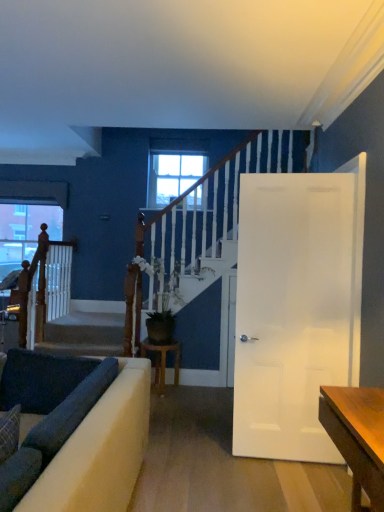
Question: Is clear glass window at center, positioned as the 2th window in left-to-right order, not near white glossy door at right?

Choices:
 (A) yes
 (B) no

Answer: (A)

Question: From the image's perspective, is clear glass window at center, acting as the first window starting from the top, located beneath white glossy door at right?

Choices:
 (A) yes
 (B) no

Answer: (B)

Question: Considering the relative sizes of clear glass window at center, acting as the first window starting from the top, and white glossy door at right in the image provided, is clear glass window at center, acting as the first window starting from the top, bigger than white glossy door at right?

Choices:
 (A) no
 (B) yes

Answer: (A)

Question: Is clear glass window at center, which is the second window in back-to-front order, turned away from white glossy door at right?

Choices:
 (A) yes
 (B) no

Answer: (B)

Question: Is clear glass window at center, positioned as the 2th window in left-to-right order, positioned in front of white glossy door at right?

Choices:
 (A) no
 (B) yes

Answer: (A)

Question: From the image's perspective, does clear glass window at center, which is the second window in back-to-front order, appear higher than white glossy door at right?

Choices:
 (A) no
 (B) yes

Answer: (B)

Question: Is white glossy door at right positioned with its back to green leafy plant at center?

Choices:
 (A) no
 (B) yes

Answer: (A)

Question: From a real-world perspective, is white glossy door at right located higher than green leafy plant at center?

Choices:
 (A) no
 (B) yes

Answer: (B)

Question: Could you tell me if white glossy door at right is facing green leafy plant at center?

Choices:
 (A) no
 (B) yes

Answer: (A)

Question: Considering the relative sizes of white glossy door at right and green leafy plant at center in the image provided, is white glossy door at right thinner than green leafy plant at center?

Choices:
 (A) no
 (B) yes

Answer: (B)

Question: Is white glossy door at right smaller than green leafy plant at center?

Choices:
 (A) yes
 (B) no

Answer: (A)

Question: From a real-world perspective, does white glossy door at right sit lower than green leafy plant at center?

Choices:
 (A) no
 (B) yes

Answer: (A)

Question: Is wooden stool at center a part of dark fabric cushion at lower left?

Choices:
 (A) yes
 (B) no

Answer: (B)